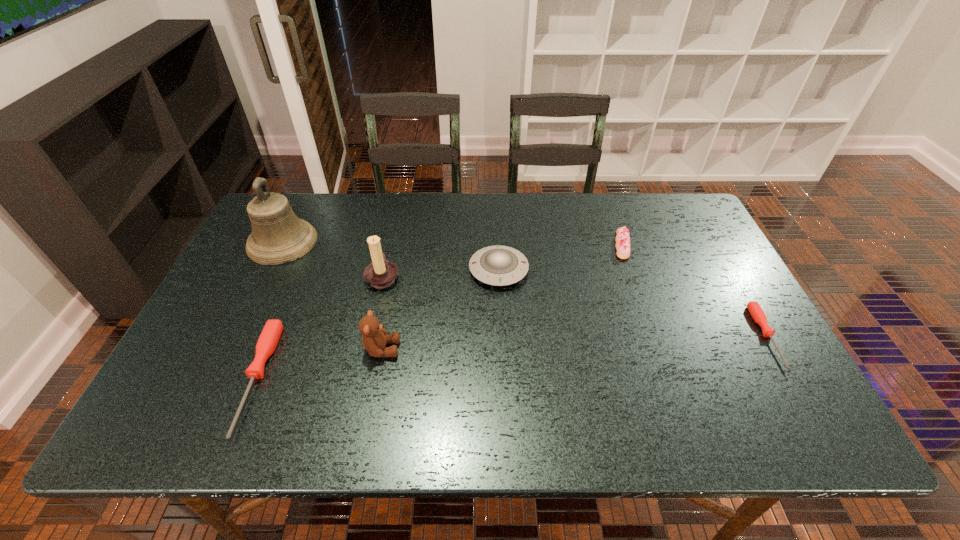
In order to click on free space located on the wick of the candle holder in this screenshot , I will do `click(535, 276)`.

Find the location of a particular element. The height and width of the screenshot is (540, 960). vacant area situated 0.150m on the right of the saucer is located at coordinates (581, 270).

Image resolution: width=960 pixels, height=540 pixels. I want to click on vacant space located 0.250m on the front of the tallest object, so click(237, 335).

Where is `vacant area situated on the face of the teddy bear`? vacant area situated on the face of the teddy bear is located at coordinates (537, 349).

This screenshot has height=540, width=960. In order to click on eclair situated at the far edge in this screenshot , I will do `click(622, 238)`.

At what (x,y) coordinates should I click in order to perform the action: click on bell that is at the far edge. Please return your answer as a coordinate pair (x, y). Looking at the image, I should click on (278, 236).

At what (x,y) coordinates should I click in order to perform the action: click on object that is at the left edge. Please return your answer as a coordinate pair (x, y). This screenshot has width=960, height=540. Looking at the image, I should click on (278, 236).

Locate an element on the screen. Image resolution: width=960 pixels, height=540 pixels. object located in the right edge section of the desktop is located at coordinates (757, 313).

Where is `object located at the far left corner`? The height and width of the screenshot is (540, 960). object located at the far left corner is located at coordinates (278, 236).

The image size is (960, 540). I want to click on object present at the near right corner, so click(x=757, y=313).